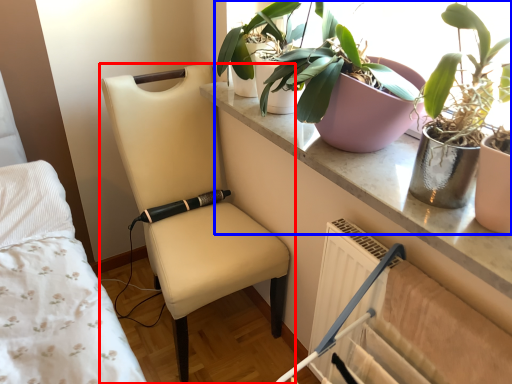
Question: Which of the following is the farthest to the observer, chair (highlighted by a red box) or houseplant (highlighted by a blue box)?

Choices:
 (A) chair
 (B) houseplant

Answer: (A)